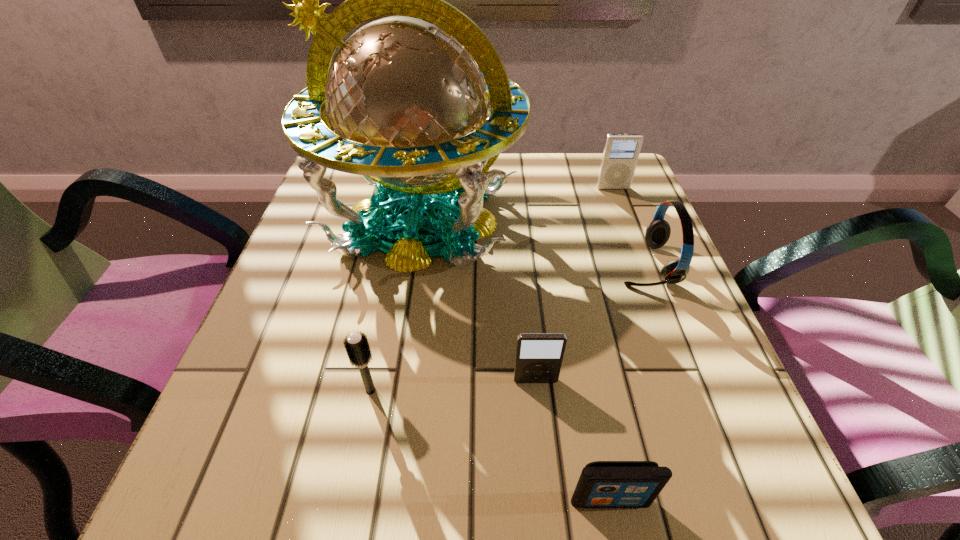
Select which iPod appears as the closest to the nearest object. Please provide its 2D coordinates. Your answer should be formatted as a tuple, i.e. [(x, y)], where the tuple contains the x and y coordinates of a point satisfying the conditions above.

[(539, 356)]

At what (x,y) coordinates should I click in order to perform the action: click on vacant space that satisfies the following two spatial constraints: 1. with the microphone attached to the side of the headset; 2. on the front screen of the shortest object. Please return your answer as a coordinate pair (x, y). The image size is (960, 540). Looking at the image, I should click on (735, 500).

Identify the location of free space in the image that satisfies the following two spatial constraints: 1. with the microphone attached to the side of the headset; 2. on the front side of the hairbrush. (x=694, y=390).

Locate an element on the screen. free space that satisfies the following two spatial constraints: 1. with the microphone attached to the side of the headset; 2. on the front screen of the nearest object is located at coordinates (735, 500).

Locate an element on the screen. Image resolution: width=960 pixels, height=540 pixels. free location that satisfies the following two spatial constraints: 1. with the microphone attached to the side of the headset; 2. on the front-facing side of the second shortest iPod is located at coordinates (690, 381).